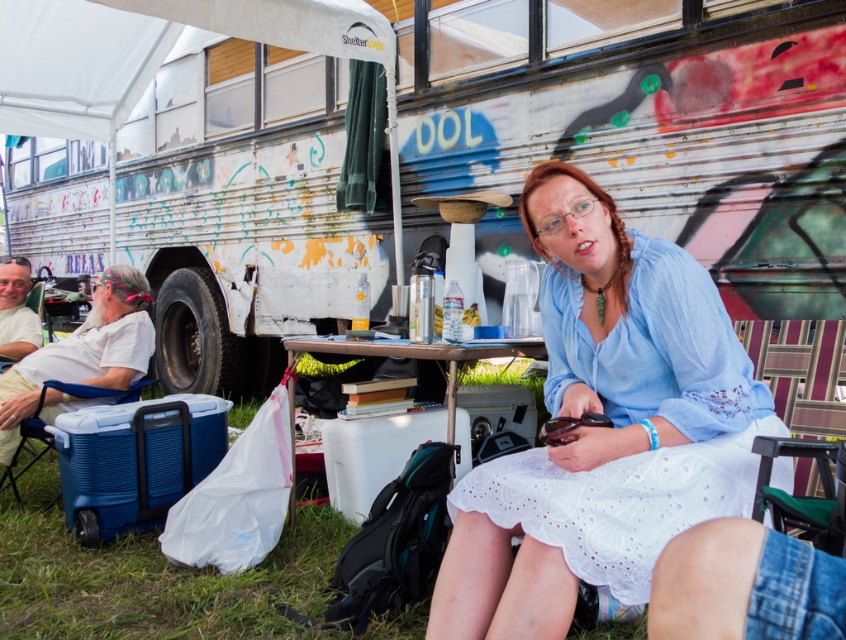
Is white lace dress at center to the left of blue plastic cooler at lower left from the viewer's perspective?

In fact, white lace dress at center is to the right of blue plastic cooler at lower left.

Is point (640, 556) behind point (95, 397)?

No, (640, 556) is closer to viewer.

What do you see at coordinates (603, 428) in the screenshot? I see `white lace dress at center` at bounding box center [603, 428].

Identify the location of white lace dress at center. This screenshot has width=846, height=640. (603, 428).

Is wooden table at center taller than blue plastic cooler at lower left?

Incorrect, wooden table at center's height is not larger of blue plastic cooler at lower left's.

The image size is (846, 640). Find the location of `wooden table at center`. wooden table at center is located at coordinates (411, 355).

Locate an element on the screen. This screenshot has width=846, height=640. wooden table at center is located at coordinates (411, 355).

This screenshot has width=846, height=640. I want to click on white painted bus at center, so click(644, 125).

Is point (454, 156) positioned before point (514, 522)?

No, it is behind (514, 522).

The image size is (846, 640). What do you see at coordinates (644, 125) in the screenshot?
I see `white painted bus at center` at bounding box center [644, 125].

At what (x,y) coordinates should I click in order to perform the action: click on white painted bus at center. Please return your answer as a coordinate pair (x, y). The height and width of the screenshot is (640, 846). Looking at the image, I should click on (644, 125).